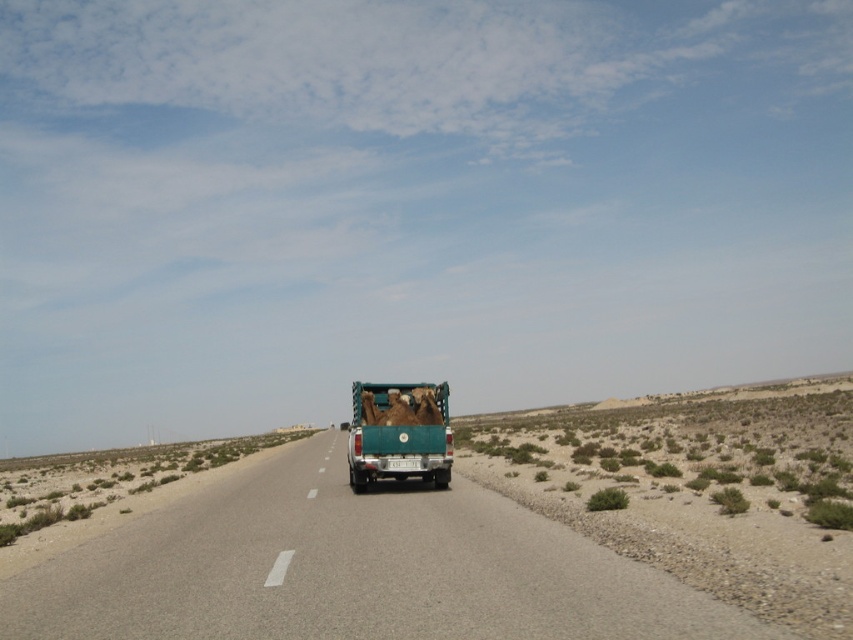
Question: Where is asphalt road at center located in relation to green matte truck at center in the image?

Choices:
 (A) left
 (B) right

Answer: (A)

Question: Among these objects, which one is farthest from the camera?

Choices:
 (A) asphalt road at center
 (B) green matte truck at center

Answer: (B)

Question: In this image, where is asphalt road at center located relative to green matte truck at center?

Choices:
 (A) below
 (B) above

Answer: (A)

Question: Which object appears farthest from the camera in this image?

Choices:
 (A) green matte truck at center
 (B) asphalt road at center

Answer: (A)

Question: Is asphalt road at center below green matte truck at center?

Choices:
 (A) yes
 (B) no

Answer: (A)